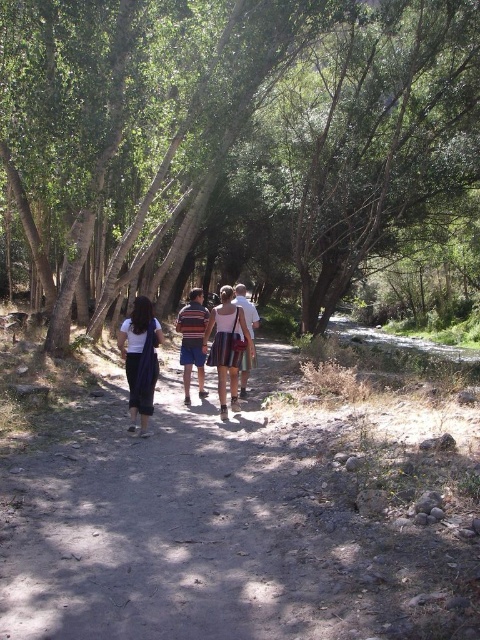
In the scene, there are two people wearing striped clothing items. One has a striped fabric skirt at center and the other has a striped shirt at center. Which of these two clothing items is smaller in size?

The striped fabric skirt at center is smaller than the striped shirt at center.